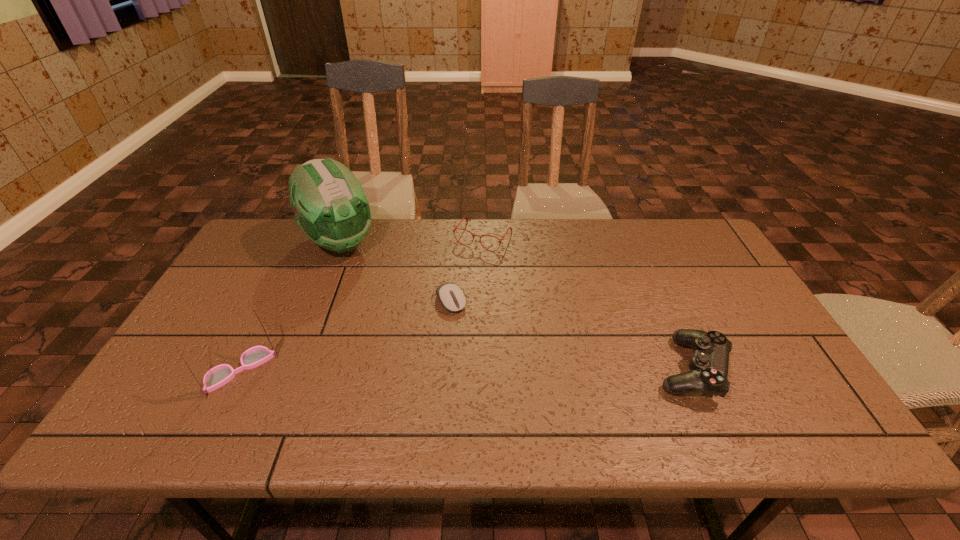
At what (x,y) coordinates should I click in order to perform the action: click on vacant space on the desktop that is between the second tallest object and the third shortest object and is positioned on the wheel side of the computer equipment. Please return your answer as a coordinate pair (x, y). Looking at the image, I should click on (497, 369).

You are a GUI agent. You are given a task and a screenshot of the screen. Output one action in this format:
    pyautogui.click(x=<x>, y=<y>)
    Task: Click on the vacant space on the desktop that is between the left spectacles and the third tallest object and is positioned on the visor of the tallest object
    
    Given the screenshot: What is the action you would take?
    pyautogui.click(x=442, y=369)

This screenshot has height=540, width=960. What are the coordinates of `free space on the desktop that is between the taller spectacles and the third tallest object and is positioned on the face of the right spectacles` in the screenshot? It's located at (399, 369).